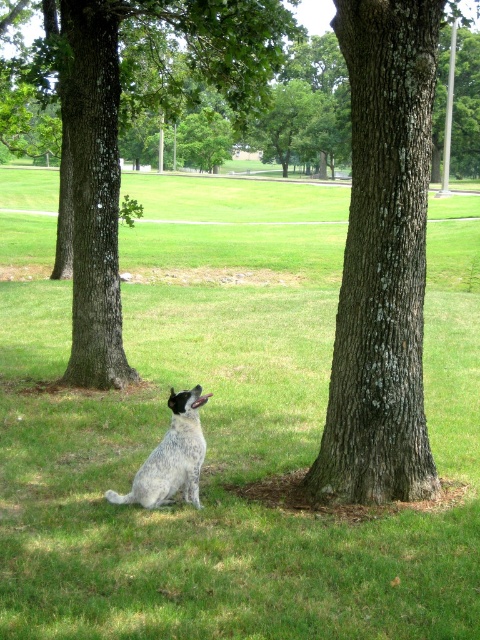
You are a dog owner who wants to walk your dog from the green grass at center to the brown rough tree at center. Which direction should you move your dog to reach the tree?

The green grass at center is on the left side of the brown rough tree at center, so you should move your dog to the right to reach the tree.

You are a photographer trying to capture a clear photo of the spotted fur dog at center. However, the green grass at center is obstructing your view. What should you do to ensure the dog is fully visible?

The green grass at center is taller than the spotted fur dog at center, so you should adjust your camera angle or move closer to the dog to ensure the grass does not block the view.

You are a photographer trying to capture the smooth bark tree at center and the spotted fur dog at center in a single shot. Based on their positions, can you tell if the tree is taller than the dog?

The smooth bark tree at center is above the spotted fur dog at center, so yes, the tree is taller than the dog.